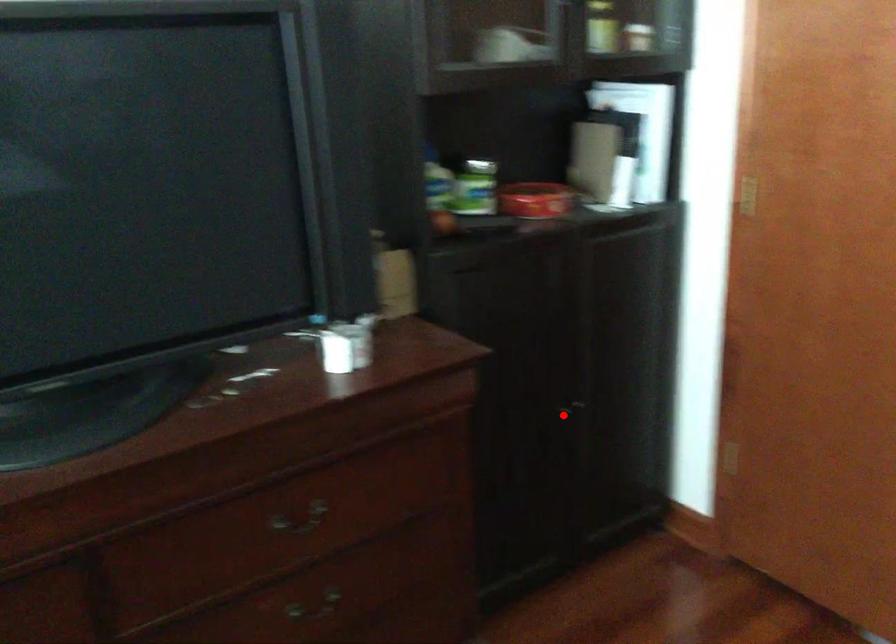
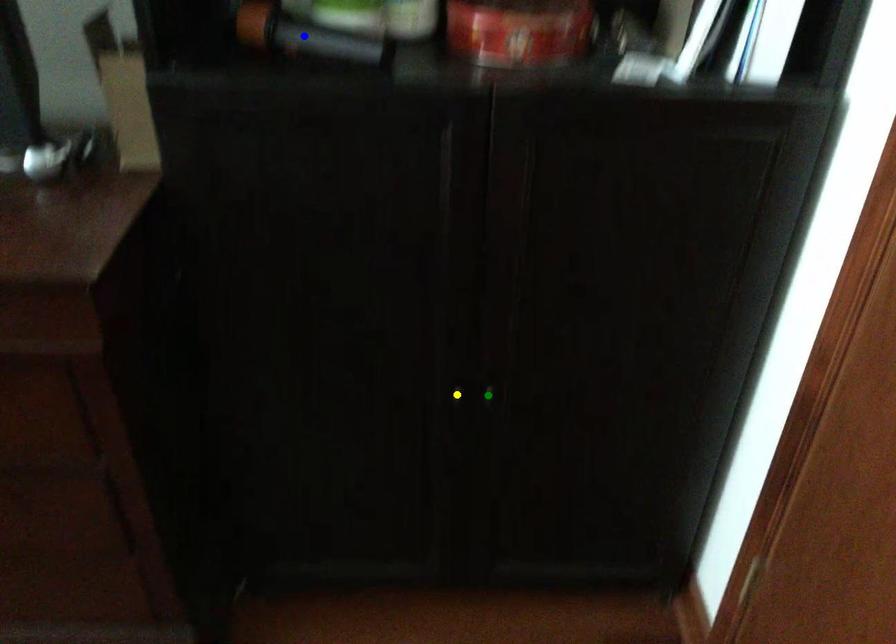
Question: I am providing you with two images of the same scene from different viewpoints. A red point is marked on the first image. You are given multiple points on the second image. Can you choose the point in image 2 that corresponds to the point in image 1?

Choices:
 (A) yellow point
 (B) green point
 (C) blue point

Answer: (A)